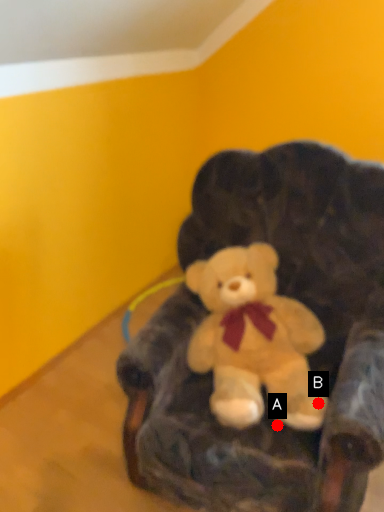
Question: Two points are circled on the image, labeled by A and B beside each circle. Which point appears farthest from the camera in this image?

Choices:
 (A) A is further
 (B) B is further

Answer: (A)